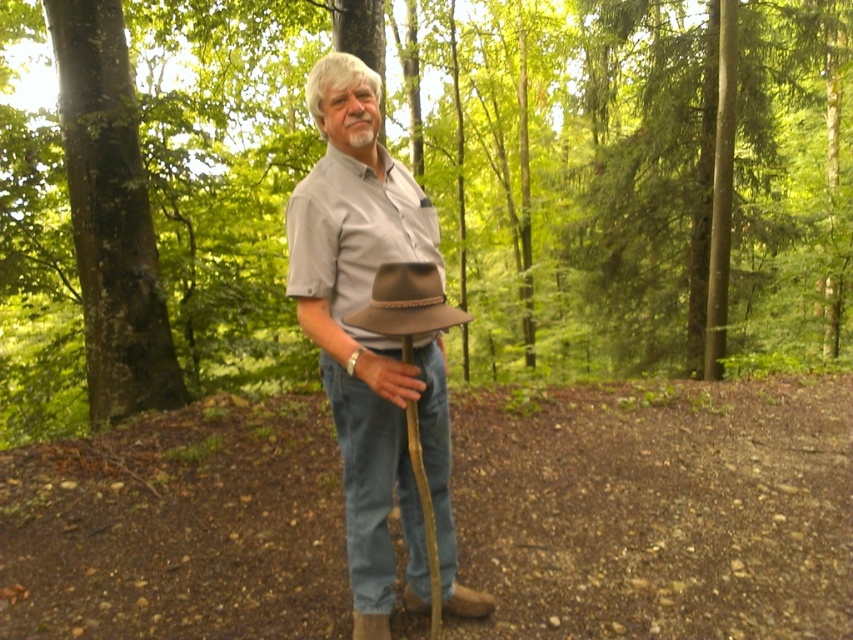
Question: Can you confirm if brown felt hat at center is positioned to the left of green rough bark tree at left?

Choices:
 (A) yes
 (B) no

Answer: (B)

Question: Which object appears closest to the camera in this image?

Choices:
 (A) brown textured hat at center
 (B) green rough bark tree at left

Answer: (A)

Question: Considering the real-world distances, which object is closest to the brown felt hat at center?

Choices:
 (A) brown textured hat at center
 (B) green rough bark tree at left

Answer: (B)

Question: Observing the image, what is the correct spatial positioning of brown textured hat at center in reference to brown felt hat at center?

Choices:
 (A) right
 (B) left

Answer: (B)

Question: Which point is farther to the camera?

Choices:
 (A) brown textured hat at center
 (B) brown felt hat at center

Answer: (A)

Question: Does brown felt hat at center appear on the left side of green rough bark tree at left?

Choices:
 (A) no
 (B) yes

Answer: (A)